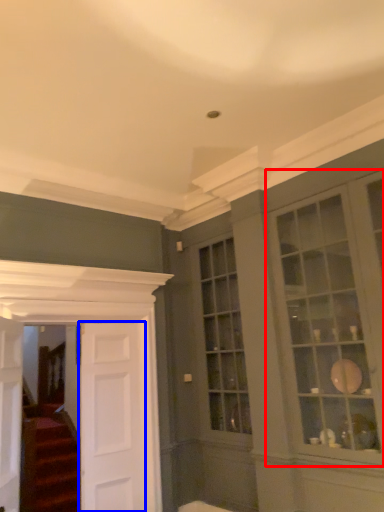
Question: Which object appears closest to the camera in this image, window (highlighted by a red box) or door (highlighted by a blue box)?

Choices:
 (A) window
 (B) door

Answer: (A)